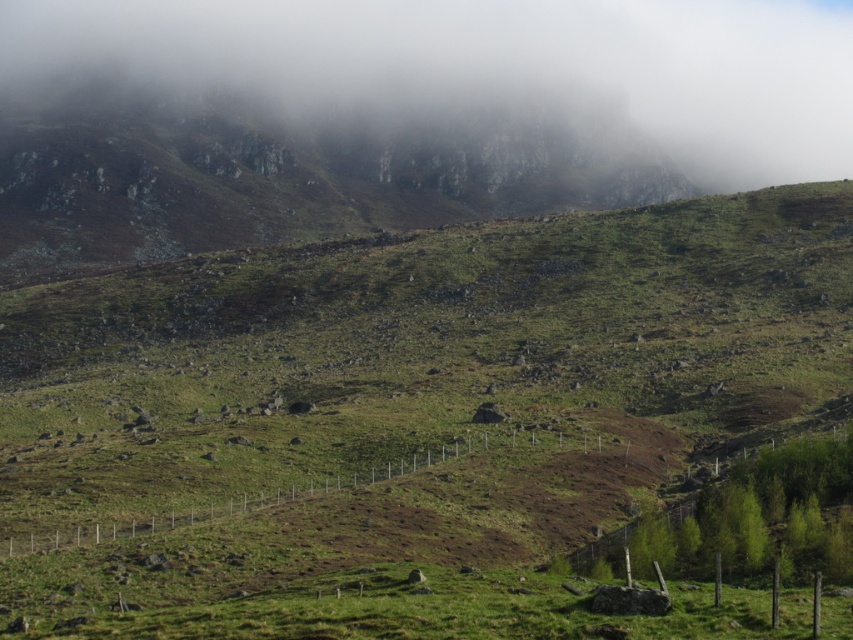
Is foggy rock formation at upper center taller than green grassy field at lower center?

Correct, foggy rock formation at upper center is much taller as green grassy field at lower center.

Between foggy rock formation at upper center and green grassy field at lower center, which one has more height?

Standing taller between the two is foggy rock formation at upper center.

What do you see at coordinates (498, 65) in the screenshot? Image resolution: width=853 pixels, height=640 pixels. I see `foggy rock formation at upper center` at bounding box center [498, 65].

This screenshot has height=640, width=853. What are the coordinates of `foggy rock formation at upper center` in the screenshot? It's located at (498, 65).

Is rocky gray mountain at upper left to the left of green grassy field at lower center from the viewer's perspective?

Yes, rocky gray mountain at upper left is to the left of green grassy field at lower center.

Does point (184, 216) come in front of point (590, 609)?

No, (184, 216) is behind (590, 609).

You are a GUI agent. You are given a task and a screenshot of the screen. Output one action in this format:
    pyautogui.click(x=<x>, y=<y>)
    Task: Click on the rocky gray mountain at upper left
    The height and width of the screenshot is (640, 853).
    Given the screenshot: What is the action you would take?
    274,177

Can you confirm if foggy rock formation at upper center is thinner than rocky gray mountain at upper left?

In fact, foggy rock formation at upper center might be wider than rocky gray mountain at upper left.

Who is positioned more to the right, foggy rock formation at upper center or rocky gray mountain at upper left?

foggy rock formation at upper center is more to the right.

Is point (358, 38) less distant than point (358, 204)?

No, it is behind (358, 204).

What are the coordinates of `foggy rock formation at upper center` in the screenshot? It's located at (498, 65).